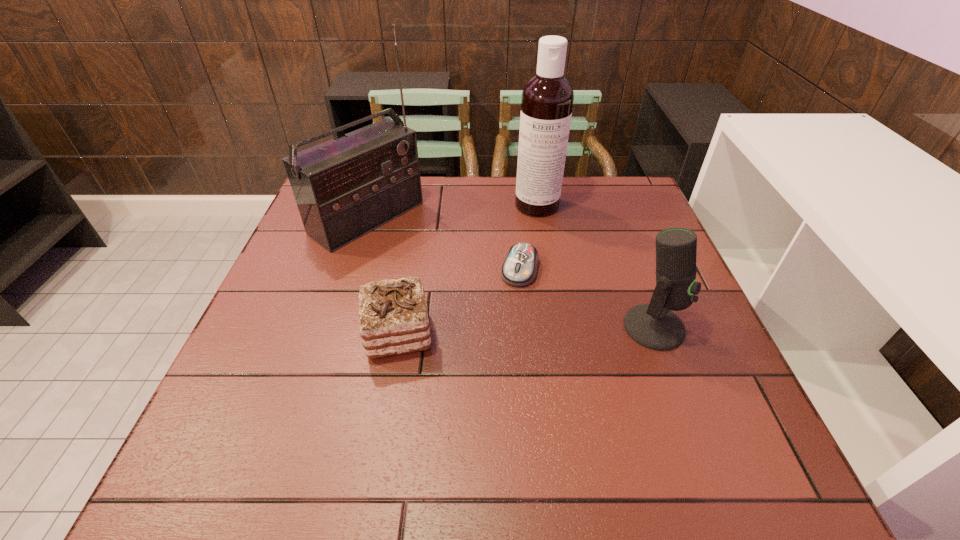
Image resolution: width=960 pixels, height=540 pixels. Find the location of `free space on the desktop that is between the chocolate cake and the microphone and is positioned on the front panel of the radio receiver`. free space on the desktop that is between the chocolate cake and the microphone and is positioned on the front panel of the radio receiver is located at coordinates (537, 330).

In order to click on vacant space on the desktop that is between the fourth tallest object and the microphone and is positioned on the label side of the dishwasher detergent in this screenshot , I will do click(550, 329).

I want to click on free spot on the desktop that is between the second shortest object and the microphone and is positioned on the wheel side of the shortest object, so click(x=500, y=331).